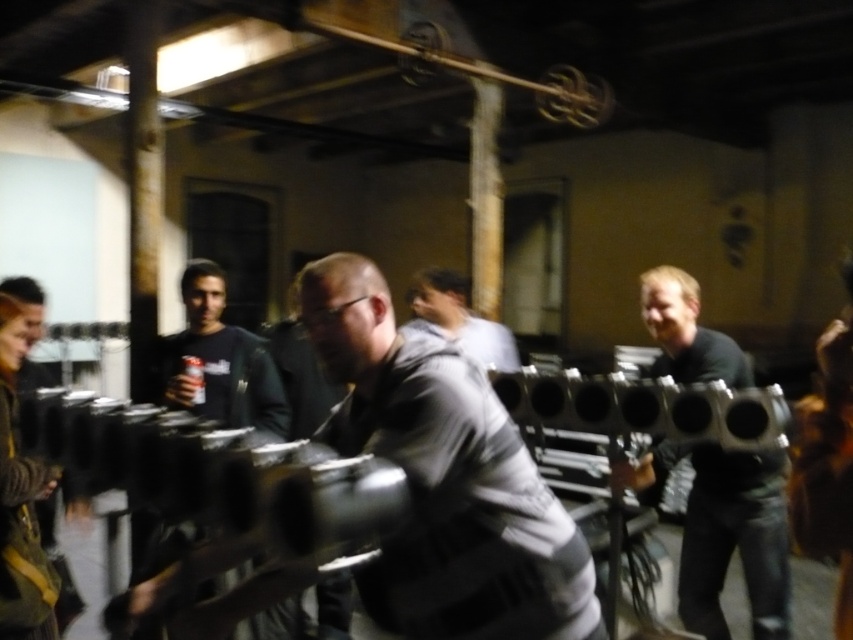
Is black matte helmet at center taller than gray fabric shirt at center?

Correct, black matte helmet at center is much taller as gray fabric shirt at center.

This screenshot has width=853, height=640. I want to click on black matte helmet at center, so click(724, 532).

Who is positioned more to the left, gray matte jacket at center or gray fabric shirt at center?

gray matte jacket at center is more to the left.

Can you confirm if gray matte jacket at center is bigger than gray fabric shirt at center?

No, gray matte jacket at center is not bigger than gray fabric shirt at center.

This screenshot has height=640, width=853. What do you see at coordinates (445, 474) in the screenshot?
I see `gray matte jacket at center` at bounding box center [445, 474].

Image resolution: width=853 pixels, height=640 pixels. Find the location of `gray matte jacket at center`. gray matte jacket at center is located at coordinates (445, 474).

Can you confirm if black matte shirt at center is smaller than gray fabric shirt at center?

Indeed, black matte shirt at center has a smaller size compared to gray fabric shirt at center.

Who is taller, black matte shirt at center or gray fabric shirt at center?

Standing taller between the two is black matte shirt at center.

The image size is (853, 640). Find the location of `black matte shirt at center`. black matte shirt at center is located at coordinates (219, 360).